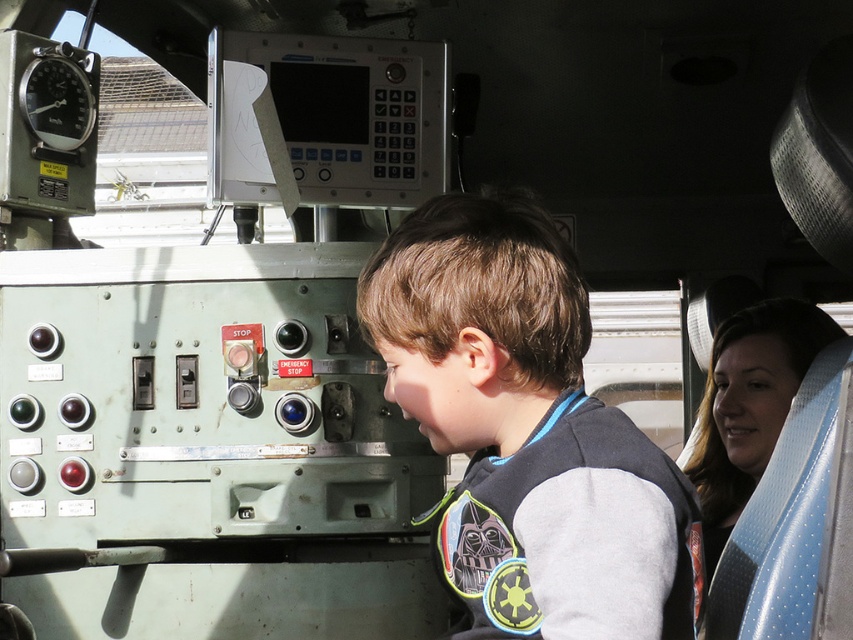
You are a passenger in the vehicle and want to sit down. There is a gray fleece sweatshirt at center and a blue textured seat at right. Which object is closer to your left side?

The gray fleece sweatshirt at center is positioned on the left side of blue textured seat at right, so the gray fleece sweatshirt at center is closer to your left side.

From the picture: You are a delivery robot with a height of 1.6 meters. You are inside a vehicle and need to move forward to deliver a package. There is a gray fleece sweatshirt at center in your path. Can you pass under it without bending?

The distance between the gray fleece sweatshirt at center and the camera is 1.58 meters. Since the robot is 1.6 meters tall, it is slightly taller than the available space, so it cannot pass under the gray fleece sweatshirt at center without bending.